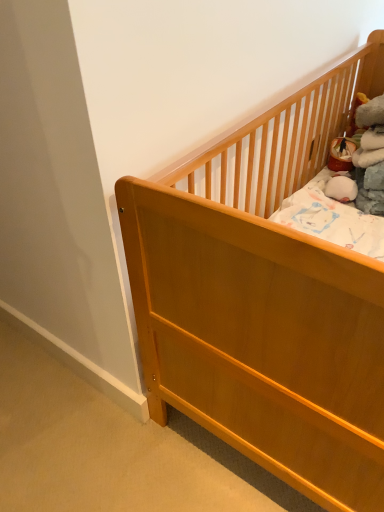
Image resolution: width=384 pixels, height=512 pixels. I want to click on light brown wooden crib at center, so click(265, 300).

The width and height of the screenshot is (384, 512). Describe the element at coordinates (265, 300) in the screenshot. I see `light brown wooden crib at center` at that location.

Locate an element on the screen. The image size is (384, 512). light brown wooden crib at center is located at coordinates (265, 300).